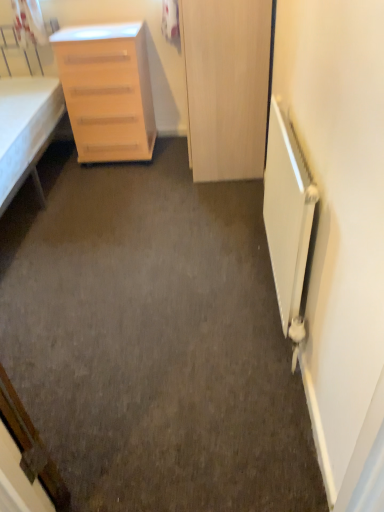
Identify the location of free space in front of white matte radiator at right. (242, 387).